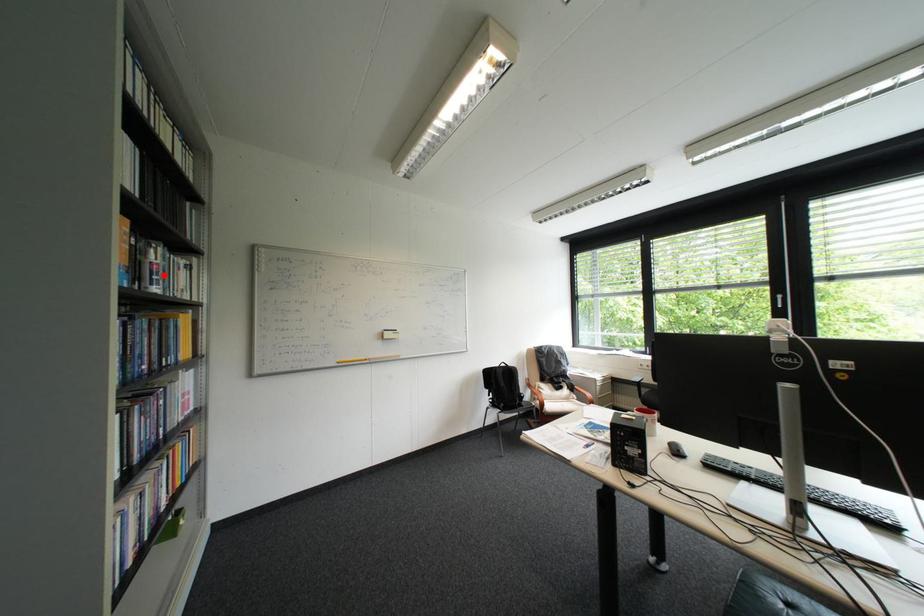
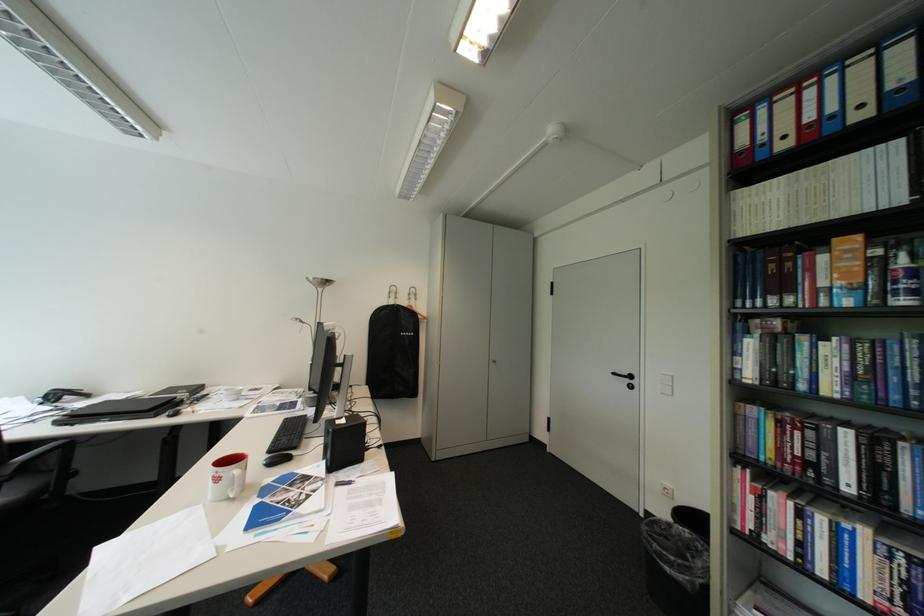
In the second image, find the point that corresponds to the highlighted location in the first image.

(907, 284)